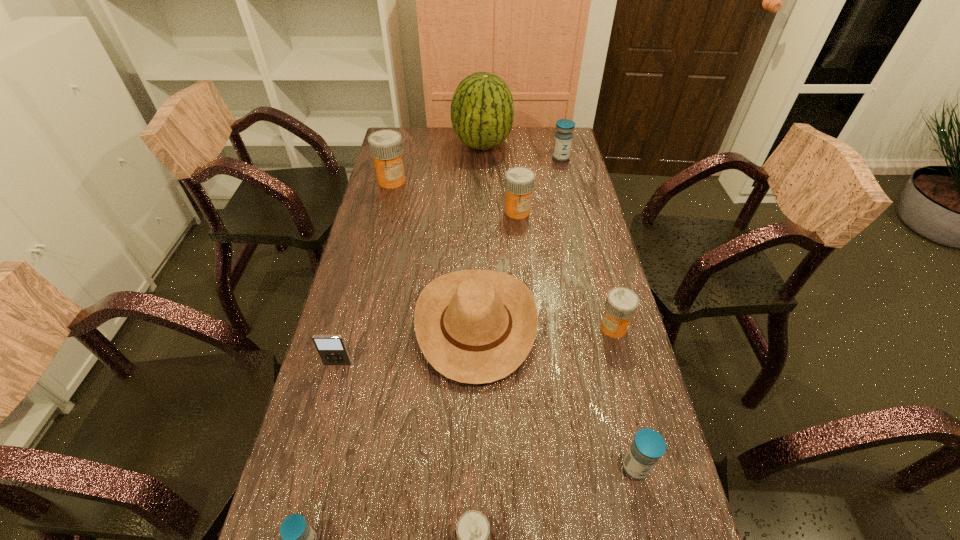
Locate which medicine ranks sixth in proximity to the fifth farthest medicine. Please provide its 2D coordinates. Your answer should be formatted as a tuple, i.e. [(x, y)], where the tuple contains the x and y coordinates of a point satisfying the conditions above.

[(563, 138)]

What are the coordinates of `the fourth closest medicine to the brown cowboy hat` in the screenshot? It's located at (472, 531).

Identify which orange medicine is the fourth nearest to the iPod. Please provide its 2D coordinates. Your answer should be formatted as a tuple, i.e. [(x, y)], where the tuple contains the x and y coordinates of a point satisfying the conditions above.

[(386, 147)]

Choose which orange medicine is the nearest neighbor to the eighth farthest object. Please provide its 2D coordinates. Your answer should be formatted as a tuple, i.e. [(x, y)], where the tuple contains the x and y coordinates of a point satisfying the conditions above.

[(472, 531)]

Identify which blue medicine is the second nearest to the brown cowboy hat. Please provide its 2D coordinates. Your answer should be formatted as a tuple, i.e. [(x, y)], where the tuple contains the x and y coordinates of a point satisfying the conditions above.

[(299, 539)]

Select which blue medicine appears as the third closest to the smallest orange medicine. Please provide its 2D coordinates. Your answer should be formatted as a tuple, i.e. [(x, y)], where the tuple contains the x and y coordinates of a point satisfying the conditions above.

[(563, 138)]

The image size is (960, 540). What are the coordinates of `vacant space that satisfies the following two spatial constraints: 1. on the front-facing side of the second smallest blue medicine; 2. on the left side of the brown cowboy hat` in the screenshot? It's located at (475, 467).

I want to click on free space that satisfies the following two spatial constraints: 1. on the back side of the fifth farthest medicine; 2. on the front-facing side of the cowboy hat, so click(x=601, y=325).